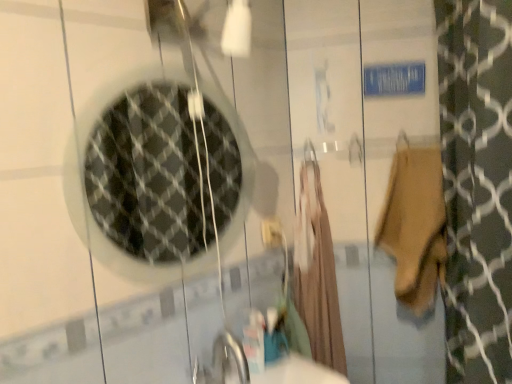
Question: From the image's perspective, is white plastic electric outlet at center over beige fabric robe at center?

Choices:
 (A) yes
 (B) no

Answer: (A)

Question: From a real-world perspective, is white plastic electric outlet at center beneath beige fabric robe at center?

Choices:
 (A) no
 (B) yes

Answer: (A)

Question: Is white plastic electric outlet at center positioned beyond the bounds of beige fabric robe at center?

Choices:
 (A) no
 (B) yes

Answer: (B)

Question: Does white plastic electric outlet at center have a lesser width compared to beige fabric robe at center?

Choices:
 (A) no
 (B) yes

Answer: (B)

Question: Is white plastic electric outlet at center not near beige fabric robe at center?

Choices:
 (A) yes
 (B) no

Answer: (B)

Question: Based on their sizes in the image, would you say beige cotton towel at right is bigger or smaller than white plastic electric outlet at center?

Choices:
 (A) big
 (B) small

Answer: (A)

Question: In the image, is beige cotton towel at right on the left side or the right side of white plastic electric outlet at center?

Choices:
 (A) left
 (B) right

Answer: (B)

Question: From the image's perspective, is beige cotton towel at right above or below white plastic electric outlet at center?

Choices:
 (A) above
 (B) below

Answer: (A)

Question: Is beige cotton towel at right spatially inside white plastic electric outlet at center, or outside of it?

Choices:
 (A) outside
 (B) inside

Answer: (A)

Question: Based on their sizes in the image, would you say clear glass mirror at upper left is bigger or smaller than beige fabric robe at center?

Choices:
 (A) small
 (B) big

Answer: (A)

Question: Considering their positions, is clear glass mirror at upper left located in front of or behind beige fabric robe at center?

Choices:
 (A) front
 (B) behind

Answer: (A)

Question: Visually, is clear glass mirror at upper left positioned to the left or to the right of beige fabric robe at center?

Choices:
 (A) right
 (B) left

Answer: (B)

Question: Is clear glass mirror at upper left taller or shorter than beige fabric robe at center?

Choices:
 (A) tall
 (B) short

Answer: (B)

Question: From the image's perspective, relative to beige cotton towel at right, is clear glass mirror at upper left above or below?

Choices:
 (A) above
 (B) below

Answer: (A)

Question: From a real-world perspective, is clear glass mirror at upper left above or below beige cotton towel at right?

Choices:
 (A) above
 (B) below

Answer: (A)